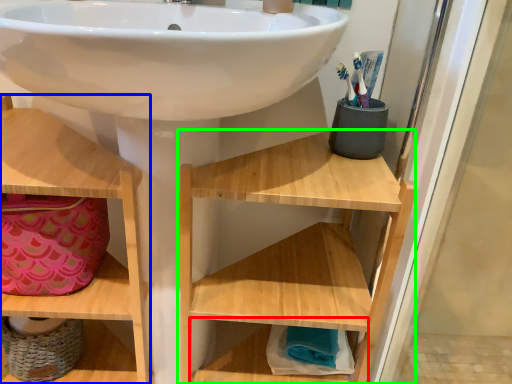
Question: Which object is positioned closest to shelf (highlighted by a red box)? Select from shelf (highlighted by a blue box) and shelf (highlighted by a green box).

Choices:
 (A) shelf
 (B) shelf

Answer: (B)